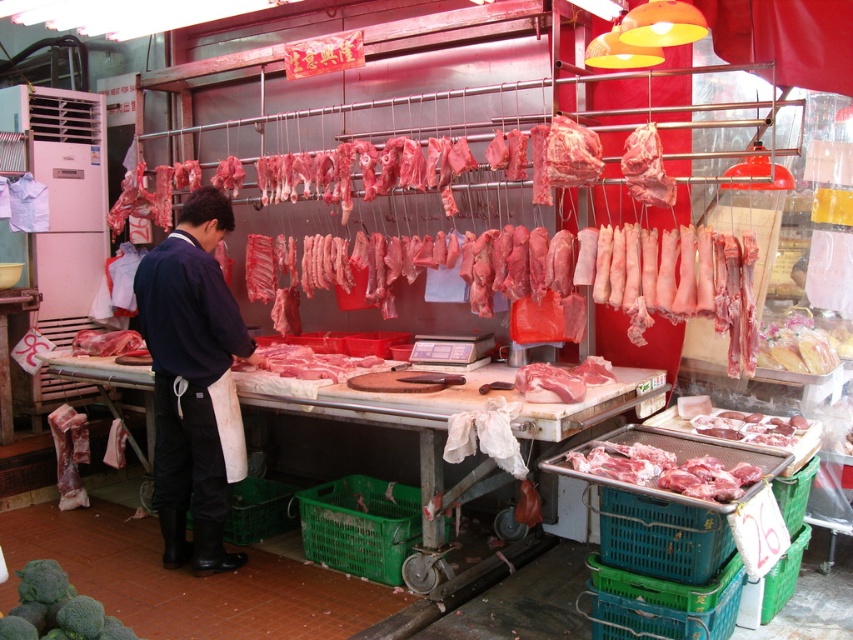
From the picture: How distant is dark blue fabric jacket at center from pink glossy meat at center?

The distance of dark blue fabric jacket at center from pink glossy meat at center is 3.08 meters.

Describe the element at coordinates (190, 378) in the screenshot. I see `dark blue fabric jacket at center` at that location.

Is point (200, 468) positioned behind point (784, 342)?

No.

In order to click on dark blue fabric jacket at center in this screenshot , I will do `click(190, 378)`.

In the scene shown: Which is more to the left, green matte broccoli at lower left or matte pink meat at lower right?

green matte broccoli at lower left is more to the left.

Who is more forward, (44, 618) or (721, 428)?

Point (44, 618) is more forward.

Identify the location of green matte broccoli at lower left. The height and width of the screenshot is (640, 853). (56, 609).

Locate an element on the screen. green matte broccoli at lower left is located at coordinates (56, 609).

Can you confirm if dark blue fabric jacket at center is shorter than matte pink meat at lower right?

Incorrect, dark blue fabric jacket at center's height does not fall short of matte pink meat at lower right's.

Does point (200, 541) come in front of point (741, 416)?

No.

Does point (178, 406) lie in front of point (752, 422)?

No, it is behind (752, 422).

I want to click on dark blue fabric jacket at center, so click(190, 378).